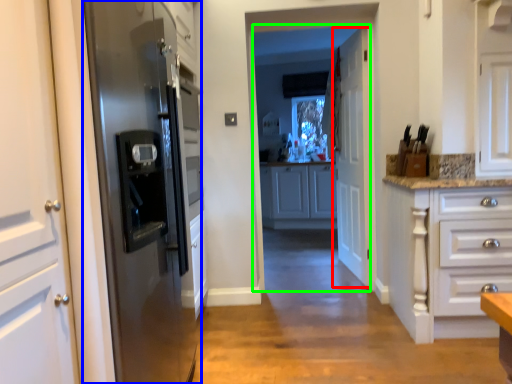
Question: Which object is positioned farthest from door (highlighted by a red box)? Select from refrigerator (highlighted by a blue box) and glass door (highlighted by a green box).

Choices:
 (A) refrigerator
 (B) glass door

Answer: (B)